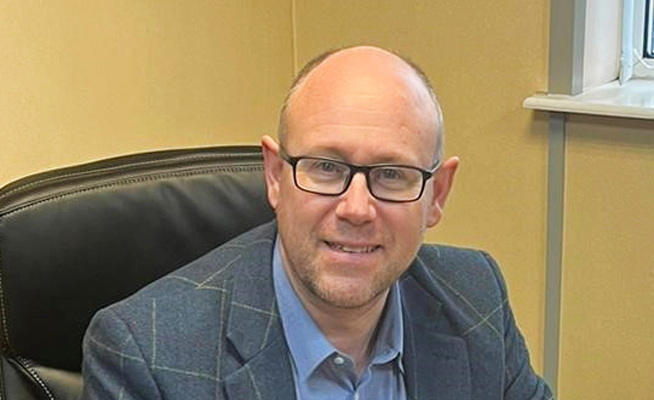
The width and height of the screenshot is (654, 400). I want to click on window, so click(649, 41).